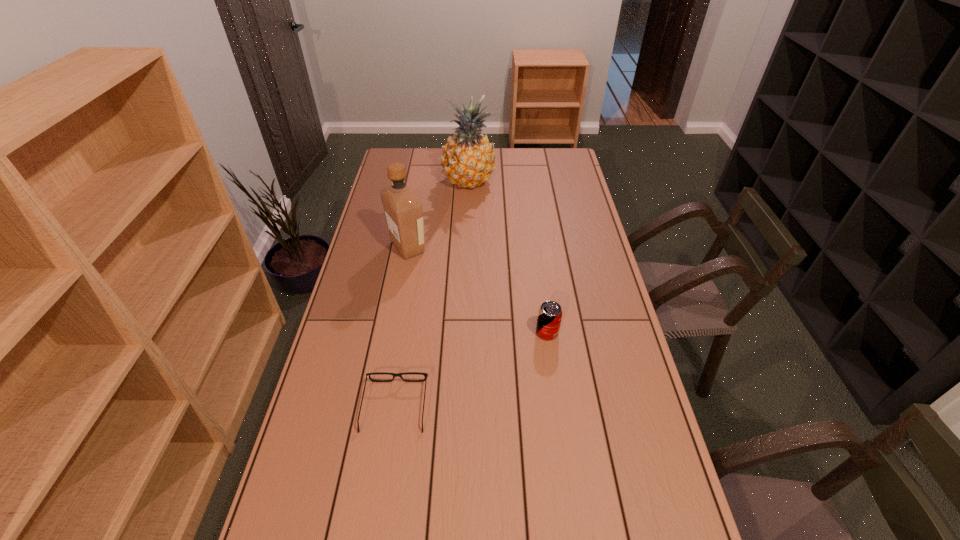
The image size is (960, 540). Find the location of `blank space located 0.320m on the front-facing side of the spectacles`. blank space located 0.320m on the front-facing side of the spectacles is located at coordinates (411, 300).

Find the location of a particular element. The height and width of the screenshot is (540, 960). free spot located on the front-facing side of the spectacles is located at coordinates (407, 325).

Where is `object at the far edge`? The image size is (960, 540). object at the far edge is located at coordinates (468, 160).

You are a GUI agent. You are given a task and a screenshot of the screen. Output one action in this format:
    pyautogui.click(x=<x>, y=<y>)
    Task: Click on the liquor present at the left edge
    
    Given the screenshot: What is the action you would take?
    pyautogui.click(x=403, y=211)

At what (x,y) coordinates should I click in order to perform the action: click on spectacles present at the left edge. Please return your answer as a coordinate pair (x, y). Image resolution: width=960 pixels, height=540 pixels. Looking at the image, I should click on (394, 375).

Find the location of a particular element. vacant space at the far edge of the desktop is located at coordinates (438, 148).

Image resolution: width=960 pixels, height=540 pixels. I want to click on free location at the left edge of the desktop, so click(364, 293).

The image size is (960, 540). What are the coordinates of `vacant space at the right edge of the desktop` in the screenshot? It's located at (552, 198).

Image resolution: width=960 pixels, height=540 pixels. I want to click on free area in between the second farthest object and the second nearest object, so click(x=477, y=290).

Locate an element on the screen. free space that is in between the farthest object and the second farthest object is located at coordinates (438, 214).